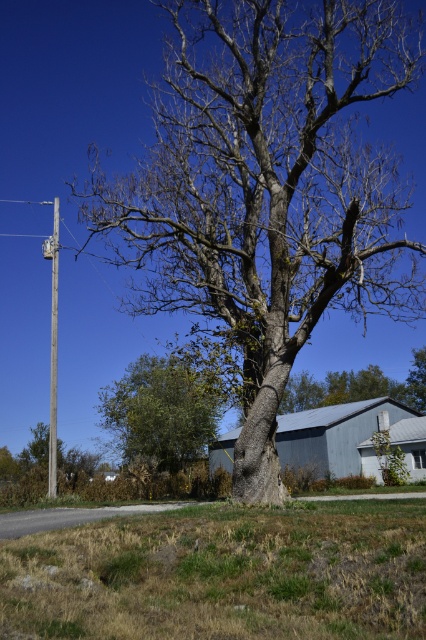
Is the position of smooth gray bark oak tree at center less distant than that of green leafy bush at lower left?

Yes, smooth gray bark oak tree at center is closer to the viewer.

Is point (342, 138) farther from viewer compared to point (114, 416)?

No.

Locate an element on the screen. smooth gray bark oak tree at center is located at coordinates click(x=265, y=193).

Is point (267, 77) more distant than point (51, 477)?

No.

Is smooth gray bark oak tree at center smaller than wooden pole at left?

Incorrect, smooth gray bark oak tree at center is not smaller in size than wooden pole at left.

In order to click on smooth gray bark oak tree at center in this screenshot , I will do `click(265, 193)`.

The width and height of the screenshot is (426, 640). I want to click on smooth gray bark oak tree at center, so click(x=265, y=193).

Is green leafy bush at lower left to the left of wooden pole at left from the viewer's perspective?

No, green leafy bush at lower left is not to the left of wooden pole at left.

Who is more forward, (134, 376) or (57, 257)?

Positioned in front is point (57, 257).

Identify the location of green leafy bush at lower left. (161, 412).